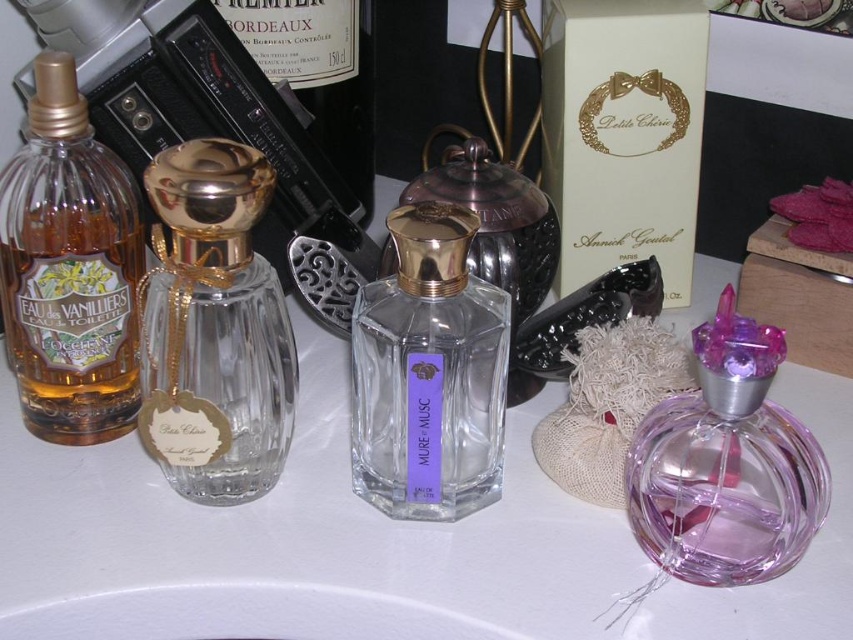
Question: Does clear glass perfume at center lie in front of matte glass bottle at left?

Choices:
 (A) yes
 (B) no

Answer: (A)

Question: Among these points, which one is farthest from the camera?

Choices:
 (A) (340, 38)
 (B) (55, 211)
 (C) (733, 307)
 (D) (428, 369)

Answer: (A)

Question: Where is matte glass bottle at left located in relation to transparent glass perfume at center in the image?

Choices:
 (A) below
 (B) above

Answer: (B)

Question: Which point appears farthest from the camera in this image?

Choices:
 (A) (112, 177)
 (B) (219, 1)
 (C) (509, 470)
 (D) (227, 276)

Answer: (B)

Question: Is white matte counter top at center to the left of transparent plastic perfume at lower right from the viewer's perspective?

Choices:
 (A) no
 (B) yes

Answer: (B)

Question: Which point is closer to the camera taking this photo?

Choices:
 (A) (212, 202)
 (B) (41, 88)
 (C) (369, 52)
 (D) (419, 332)

Answer: (A)